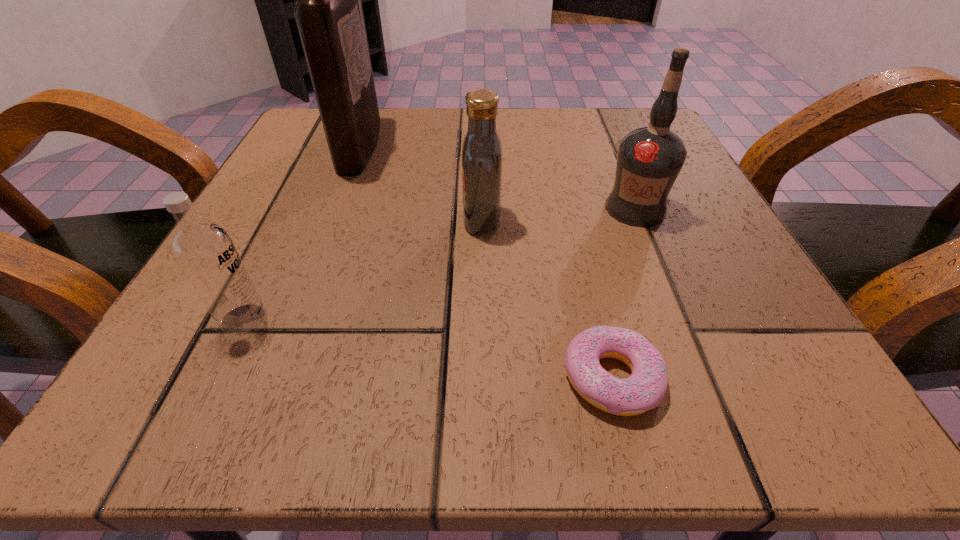
Where is `vacant area that lies between the tallest object and the second vodka from right to left`? This screenshot has width=960, height=540. vacant area that lies between the tallest object and the second vodka from right to left is located at coordinates (420, 183).

Locate an element on the screen. This screenshot has width=960, height=540. vacant space in between the nearest object and the nearest vodka is located at coordinates (427, 348).

Where is `vacant space that is in between the nearest object and the tallest vodka`? This screenshot has height=540, width=960. vacant space that is in between the nearest object and the tallest vodka is located at coordinates (623, 293).

Find the location of a particular element. The height and width of the screenshot is (540, 960). vacant space that is in between the doughnut and the tallest object is located at coordinates (486, 262).

Find the location of `free spot between the third object from left to right and the second nearest object`. free spot between the third object from left to right and the second nearest object is located at coordinates 363,269.

The height and width of the screenshot is (540, 960). Find the location of `empty location between the tallest object and the nearest vodka`. empty location between the tallest object and the nearest vodka is located at coordinates (x=301, y=233).

The height and width of the screenshot is (540, 960). I want to click on vacant space in between the third object from right to left and the nearest vodka, so click(x=363, y=269).

You are a GUI agent. You are given a task and a screenshot of the screen. Output one action in this format:
    pyautogui.click(x=<x>, y=<y>)
    Task: Click on the blank region between the doughnut and the rightmost vodka
    
    Given the screenshot: What is the action you would take?
    pyautogui.click(x=623, y=293)

The width and height of the screenshot is (960, 540). Identify the location of free point between the liquor and the third object from right to left. (420, 183).

Identify which object is located as the nearest to the doughnut. Please provide its 2D coordinates. Your answer should be formatted as a tuple, i.e. [(x, y)], where the tuple contains the x and y coordinates of a point satisfying the conditions above.

[(482, 156)]